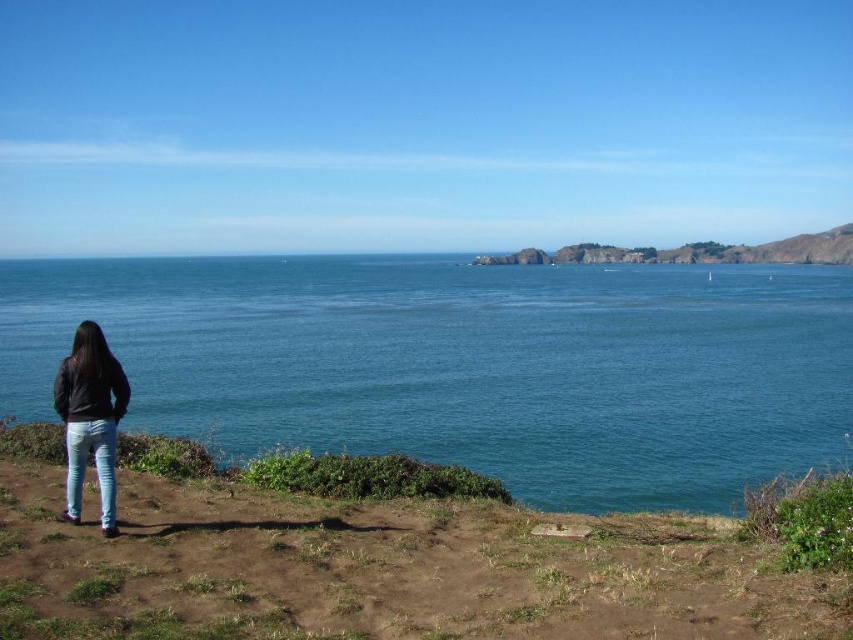
You are a photographer positioned on the grassy path and want to capture the blue denim jeans at lower left and the brown dirt at lower left in your shot. Based on their positions, which object should appear closer to the camera in the photo?

The brown dirt at lower left is in front of the blue denim jeans at lower left, so the brown dirt at lower left will appear closer to the camera in the photo.

You are standing on the brown dirt at lower left and want to walk to the rugged rock formation at center. Is the path directly between them clear of any obstacles?

The brown dirt at lower left is positioned under rugged rock formation at center, which means the rugged rock formation at center is above the brown dirt at lower left. Therefore, the path between them is blocked by the rugged rock formation at center.